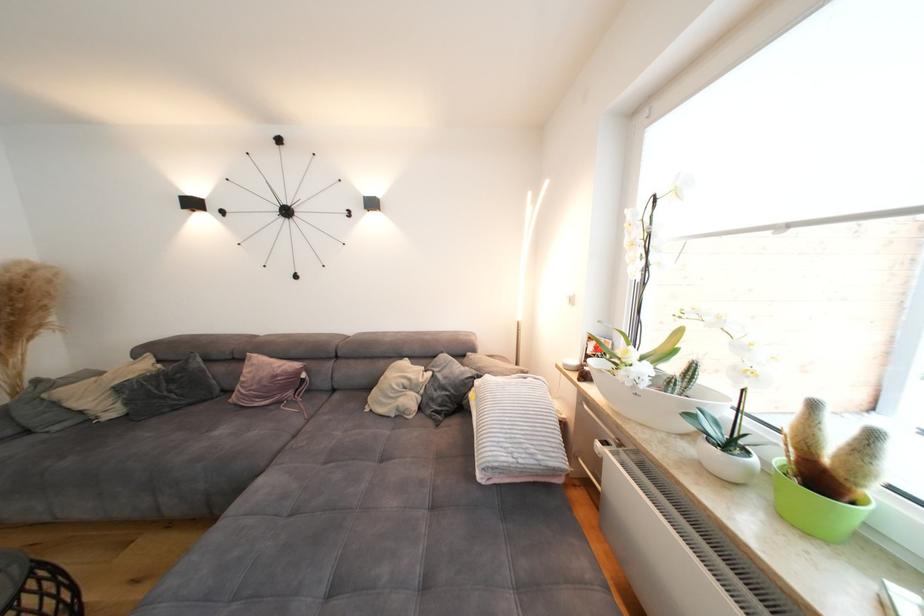
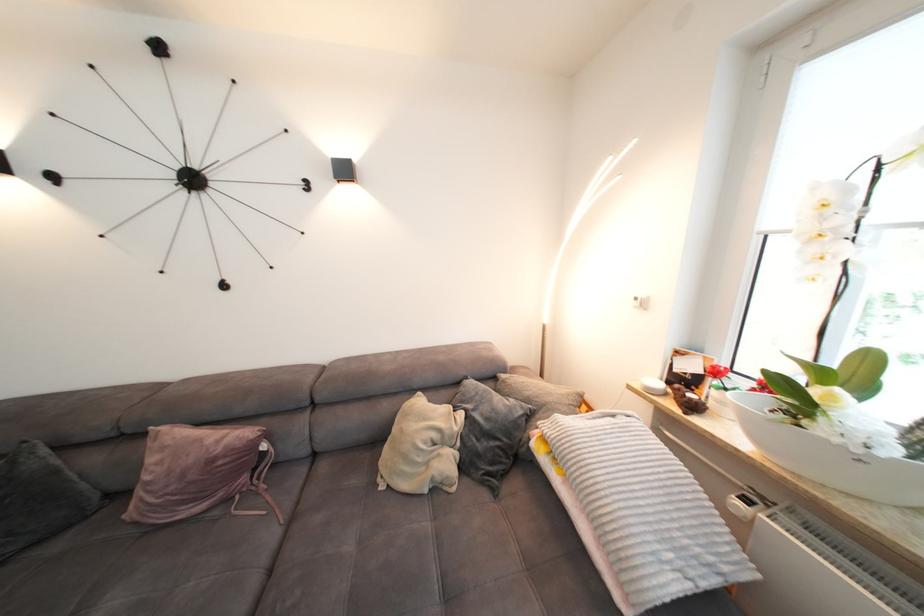
In the second image, find the point that corresponds to [343,398] in the first image.

(330, 469)